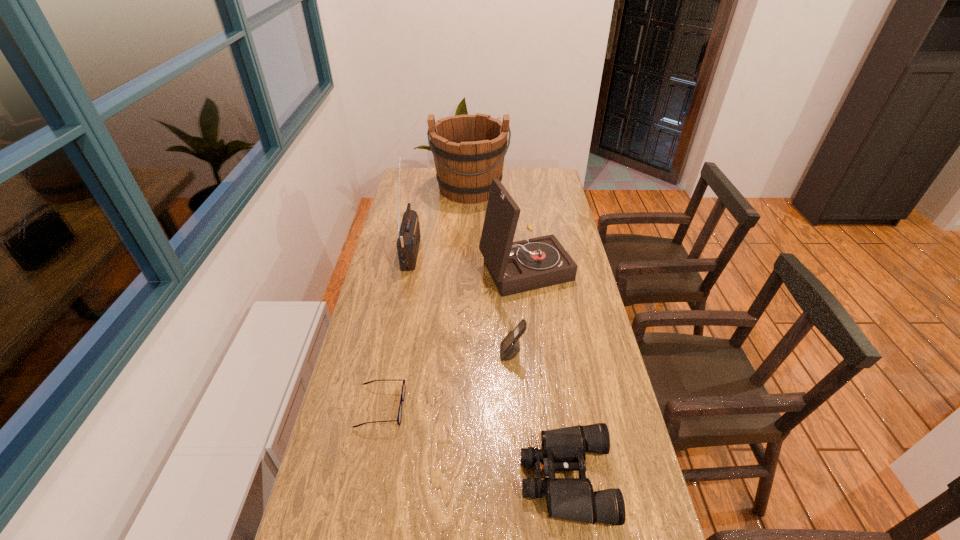
Locate an element on the screen. This screenshot has height=540, width=960. free location that satisfies the following two spatial constraints: 1. on the side of the farthest object with the handle for carrying; 2. on the front-facing side of the radio receiver is located at coordinates 468,251.

The image size is (960, 540). In order to click on vacant space that satisfies the following two spatial constraints: 1. on the side of the wine bucket with the handle for carrying; 2. on the right side of the phonograph record in this screenshot , I will do `click(468, 266)`.

Where is `vacant position in the image that satisfies the following two spatial constraints: 1. on the front-facing side of the phonograph record; 2. on the right side of the radio receiver`? The height and width of the screenshot is (540, 960). vacant position in the image that satisfies the following two spatial constraints: 1. on the front-facing side of the phonograph record; 2. on the right side of the radio receiver is located at coordinates (409, 266).